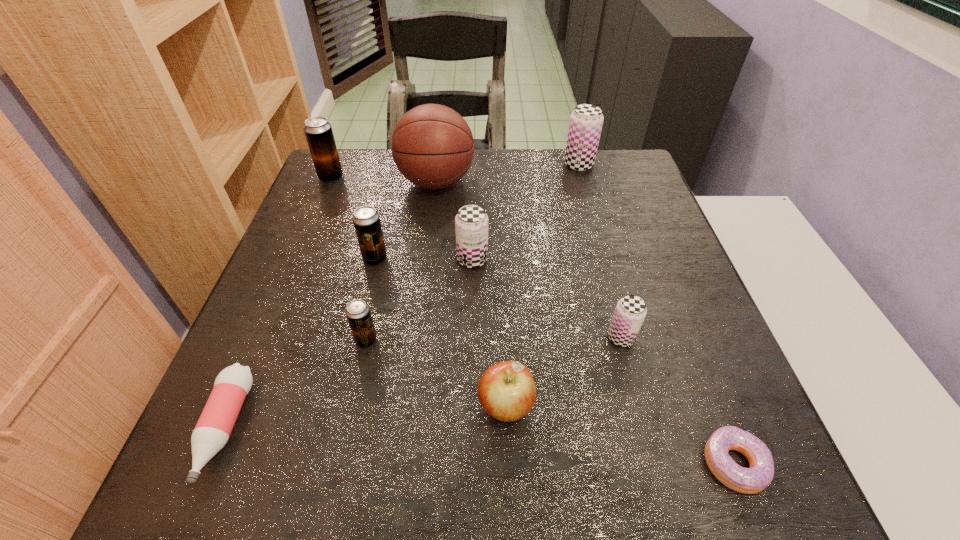
Find the location of a particular element. bottle is located at coordinates (212, 431).

The height and width of the screenshot is (540, 960). In order to click on pink bottle in this screenshot , I will do `click(212, 431)`.

Where is `doughnut`? doughnut is located at coordinates (751, 480).

At what (x,y) coordinates should I click in order to perform the action: click on the shortest object. Please return your answer as a coordinate pair (x, y). Looking at the image, I should click on (751, 480).

Where is `vacant space situated 0.230m on the right of the tallest object`? The width and height of the screenshot is (960, 540). vacant space situated 0.230m on the right of the tallest object is located at coordinates (559, 183).

Where is `vacant space located 0.330m on the left of the farthest purple beer can`? vacant space located 0.330m on the left of the farthest purple beer can is located at coordinates (448, 165).

The width and height of the screenshot is (960, 540). Find the location of `vacant space situated 0.390m on the front of the leftmost beer can`. vacant space situated 0.390m on the front of the leftmost beer can is located at coordinates (284, 290).

Find the location of a particular element. vacant area situated 0.340m on the back of the second smallest purple beer can is located at coordinates (474, 168).

Where is `free space located 0.300m on the front of the second farthest black beer can`? free space located 0.300m on the front of the second farthest black beer can is located at coordinates (345, 388).

In order to click on vacant area located 0.050m on the left of the smallest purple beer can in this screenshot , I will do `click(582, 338)`.